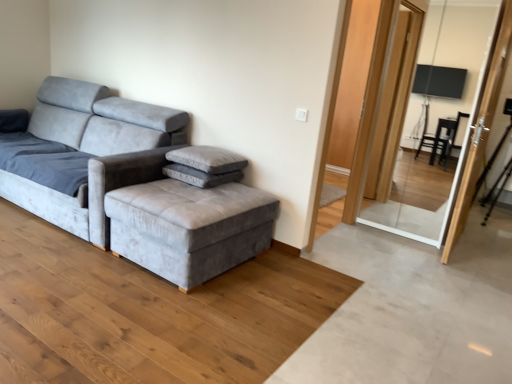
You are a GUI agent. You are given a task and a screenshot of the screen. Output one action in this format:
    pyautogui.click(x=<x>, y=<y>)
    Task: Click on the vacant area in front of transparent glass screen door at upper right, the second screen door from the right
    
    Given the screenshot: What is the action you would take?
    pyautogui.click(x=421, y=249)